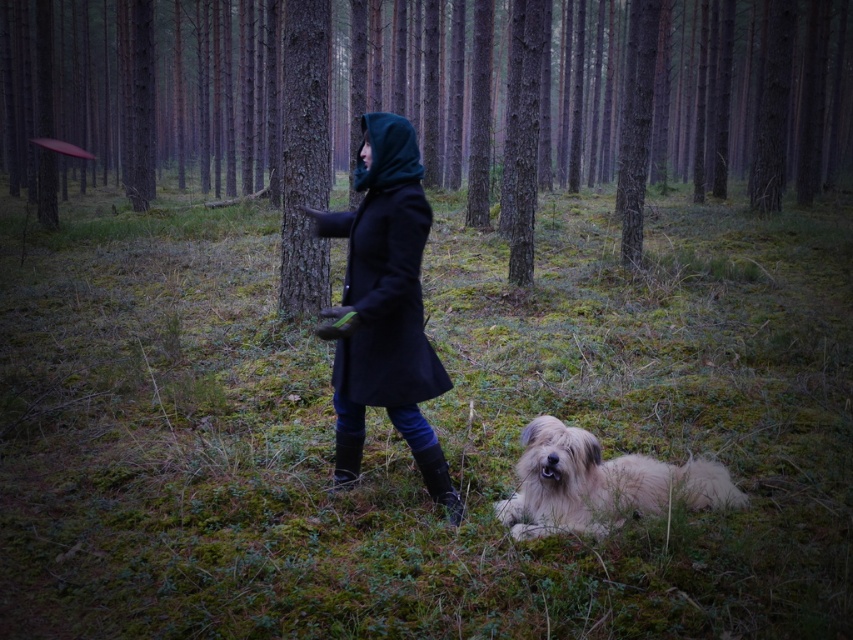
Is point (607, 532) more distant than point (289, 168)?

No, it is not.

Based on the photo, who is more distant from viewer, (567, 484) or (312, 128)?

Point (312, 128)

The height and width of the screenshot is (640, 853). Find the location of `fluffy beige dog at lower center`. fluffy beige dog at lower center is located at coordinates (601, 484).

Who is positioned more to the left, black matte coat at center or smooth bark tree at center?

smooth bark tree at center is more to the left.

Who is more forward, [389,184] or [283,209]?

Point [389,184] is in front.

The width and height of the screenshot is (853, 640). What do you see at coordinates (384, 307) in the screenshot?
I see `black matte coat at center` at bounding box center [384, 307].

Where is `black matte coat at center`? The image size is (853, 640). black matte coat at center is located at coordinates (384, 307).

Can you confirm if brown rough tree at center is positioned to the left of black matte coat at center?

Correct, you'll find brown rough tree at center to the left of black matte coat at center.

Who is shorter, brown rough tree at center or black matte coat at center?

Standing shorter between the two is black matte coat at center.

Locate an element on the screen. This screenshot has height=640, width=853. brown rough tree at center is located at coordinates pos(312,92).